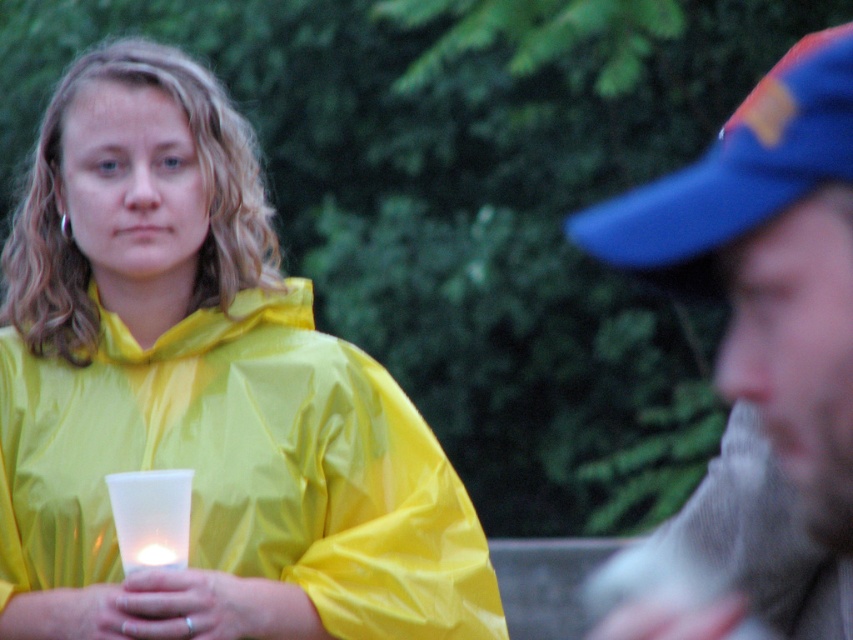
Who is shorter, blue fabric cap at upper right or blue fabric baseball cap at upper right?

Standing shorter between the two is blue fabric cap at upper right.

Can you confirm if blue fabric cap at upper right is bigger than blue fabric baseball cap at upper right?

Incorrect, blue fabric cap at upper right is not larger than blue fabric baseball cap at upper right.

Is point (759, 522) farther from viewer compared to point (648, 253)?

That is True.

Find the location of a particular element. The width and height of the screenshot is (853, 640). blue fabric cap at upper right is located at coordinates (761, 352).

Can you confirm if yellow matte raincoat at center is positioned to the right of blue fabric baseball cap at upper right?

In fact, yellow matte raincoat at center is to the left of blue fabric baseball cap at upper right.

Is yellow matte raincoat at center bigger than blue fabric baseball cap at upper right?

No, yellow matte raincoat at center is not bigger than blue fabric baseball cap at upper right.

Describe the element at coordinates (202, 396) in the screenshot. I see `yellow matte raincoat at center` at that location.

Where is `yellow matte raincoat at center`? This screenshot has height=640, width=853. yellow matte raincoat at center is located at coordinates (202, 396).

Between yellow matte raincoat at center and blue fabric cap at upper right, which one has less height?

blue fabric cap at upper right

Who is more distant from viewer, (161, 134) or (837, 260)?

Positioned behind is point (161, 134).

I want to click on yellow matte raincoat at center, so click(202, 396).